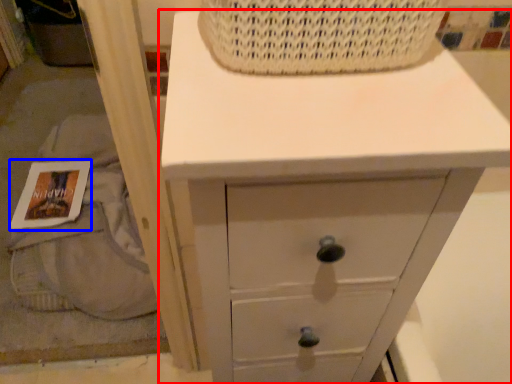
Question: Which of the following is the closest to the observer, chest of drawers (highlighted by a red box) or magazine (highlighted by a blue box)?

Choices:
 (A) chest of drawers
 (B) magazine

Answer: (A)